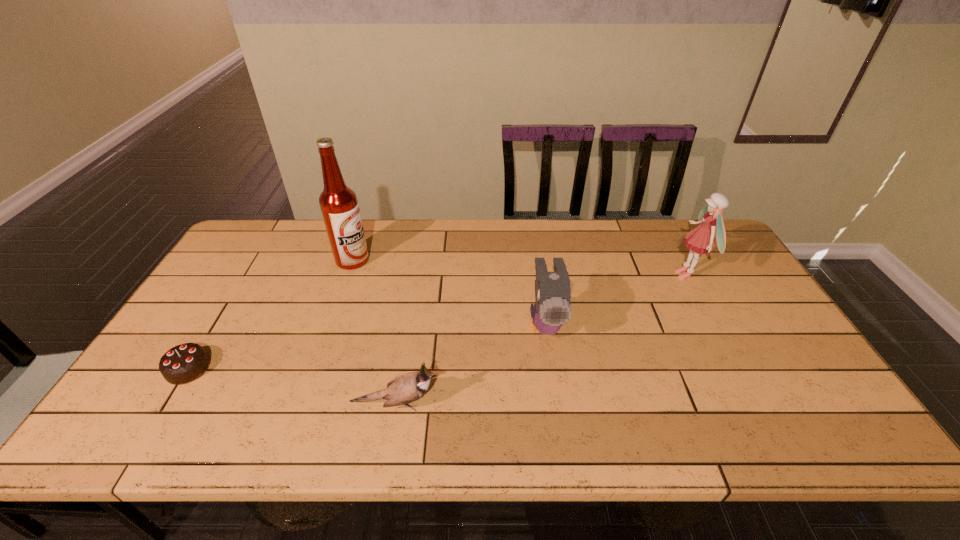
Find the location of a particular element. object that can be found as the fourth closest to the fourth object from left to right is located at coordinates (184, 363).

You are a GUI agent. You are given a task and a screenshot of the screen. Output one action in this format:
    pyautogui.click(x=<x>, y=<y>)
    Task: Click on the free spot that satisfies the following two spatial constraints: 1. at the beak of the farther bird; 2. at the face of the left bird
    The width and height of the screenshot is (960, 540).
    Given the screenshot: What is the action you would take?
    pyautogui.click(x=557, y=404)

Locate an element on the screen. Image resolution: width=960 pixels, height=540 pixels. vacant area in the image that satisfies the following two spatial constraints: 1. at the beak of the third shortest object; 2. at the face of the nearer bird is located at coordinates (557, 404).

Identify the location of vacant space that satisfies the following two spatial constraints: 1. at the beak of the right bird; 2. at the face of the fourth tallest object. (557, 404).

Image resolution: width=960 pixels, height=540 pixels. Find the location of `free space that satisfies the following two spatial constraints: 1. at the beak of the fourth object from left to right; 2. at the face of the nearest object`. free space that satisfies the following two spatial constraints: 1. at the beak of the fourth object from left to right; 2. at the face of the nearest object is located at coordinates (557, 404).